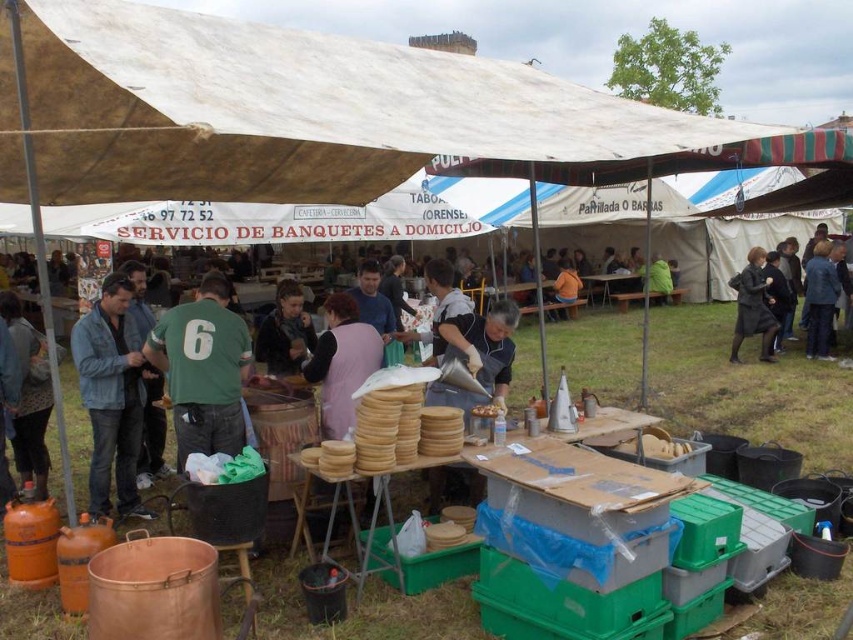
Question: Can you confirm if dark gray coat at center is bigger than blue fabric jacket at upper right?

Choices:
 (A) no
 (B) yes

Answer: (B)

Question: Where is denim jacket at left located in relation to dark gray coat at center in the image?

Choices:
 (A) right
 (B) left

Answer: (B)

Question: Can you confirm if wooden table at center is bigger than green fuzzy jacket at center?

Choices:
 (A) yes
 (B) no

Answer: (A)

Question: Which of the following is the closest to the observer?

Choices:
 (A) (755, 284)
 (B) (590, 289)

Answer: (A)

Question: Which of the following is the closest to the observer?

Choices:
 (A) orange fabric shirt at center
 (B) green fabric shirt at center
 (C) dark brown leather jacket at center
 (D) denim jacket at left

Answer: (B)

Question: Which of the following is the closest to the observer?

Choices:
 (A) dark brown leather jacket at center
 (B) green fabric shirt at center

Answer: (B)